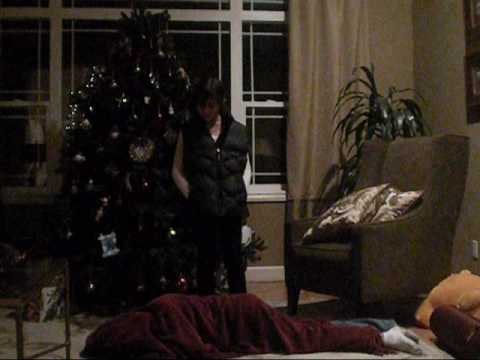
The height and width of the screenshot is (360, 480). In order to click on christmas ornament  left of woman in this screenshot , I will do `click(140, 155)`.